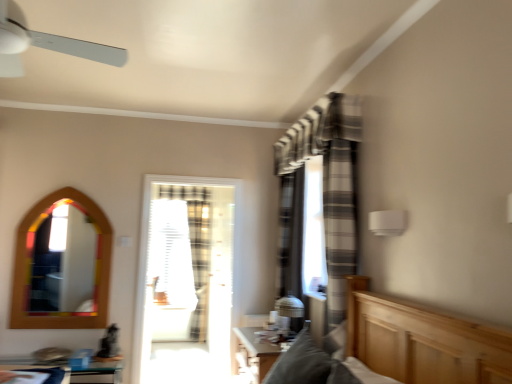
Question: From the image's perspective, is wooden table at lower center, which is counted as the 2th table, starting from the left, below translucent glass door at center?

Choices:
 (A) yes
 (B) no

Answer: (A)

Question: Can you see wooden table at lower center, which is counted as the 2th table, starting from the left, touching translucent glass door at center?

Choices:
 (A) yes
 (B) no

Answer: (B)

Question: Is wooden table at lower center, which is counted as the 2th table, starting from the left, to the left of translucent glass door at center from the viewer's perspective?

Choices:
 (A) yes
 (B) no

Answer: (B)

Question: From a real-world perspective, is wooden table at lower center, the first table positioned from the right, under translucent glass door at center?

Choices:
 (A) no
 (B) yes

Answer: (B)

Question: Is wooden table at lower center, the first table positioned from the right, taller than translucent glass door at center?

Choices:
 (A) no
 (B) yes

Answer: (A)

Question: Would you say wooden table at lower center, which is counted as the 2th table, starting from the left, contains translucent glass door at center?

Choices:
 (A) yes
 (B) no

Answer: (B)

Question: Does clear plastic screen at center appear on the left side of translucent glass door at center?

Choices:
 (A) no
 (B) yes

Answer: (B)

Question: Does clear plastic screen at center have a smaller size compared to translucent glass door at center?

Choices:
 (A) no
 (B) yes

Answer: (B)

Question: Is clear plastic screen at center in contact with translucent glass door at center?

Choices:
 (A) yes
 (B) no

Answer: (B)

Question: Is clear plastic screen at center facing towards translucent glass door at center?

Choices:
 (A) no
 (B) yes

Answer: (B)

Question: Is clear plastic screen at center not close to translucent glass door at center?

Choices:
 (A) yes
 (B) no

Answer: (B)

Question: Is clear plastic screen at center not within translucent glass door at center?

Choices:
 (A) no
 (B) yes

Answer: (B)

Question: Can you confirm if gray striped curtain at center is positioned to the left of clear plastic screen at center?

Choices:
 (A) yes
 (B) no

Answer: (B)